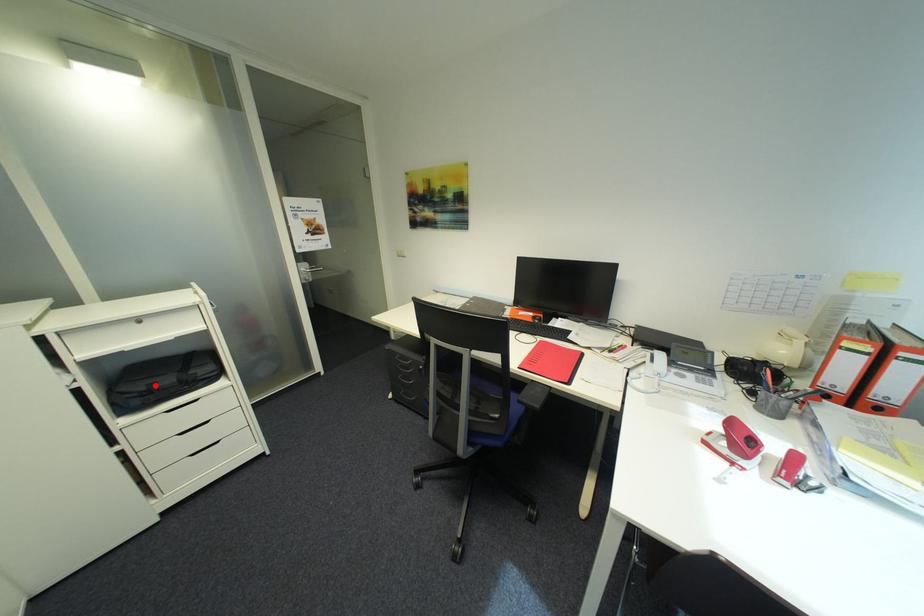
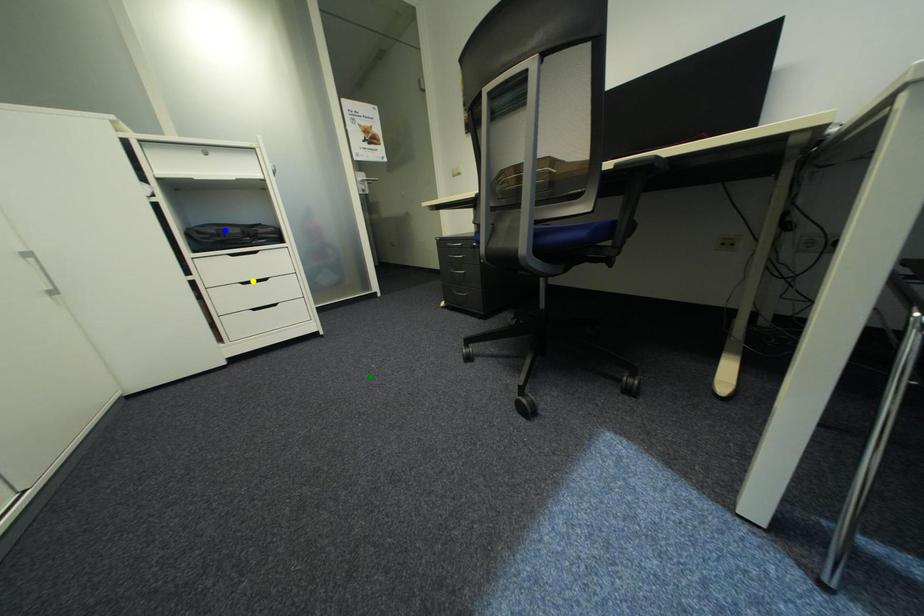
Question: I am providing you with two images of the same scene from different viewpoints. A red point is marked on the first image. You are given multiple points on the second image. In image 2, which mark is for the same physical point as the one in image 1?

Choices:
 (A) yellow point
 (B) green point
 (C) blue point

Answer: (C)